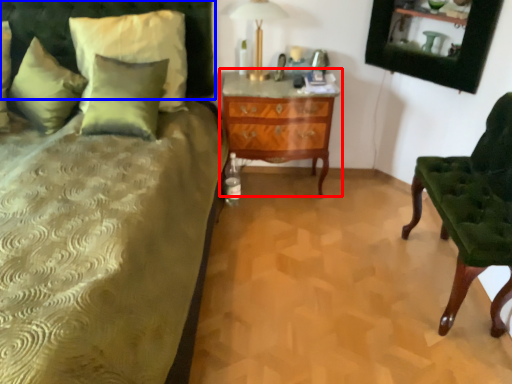
Question: Which object appears farthest to the camera in this image, nightstand (highlighted by a red box) or headboard (highlighted by a blue box)?

Choices:
 (A) nightstand
 (B) headboard

Answer: (A)